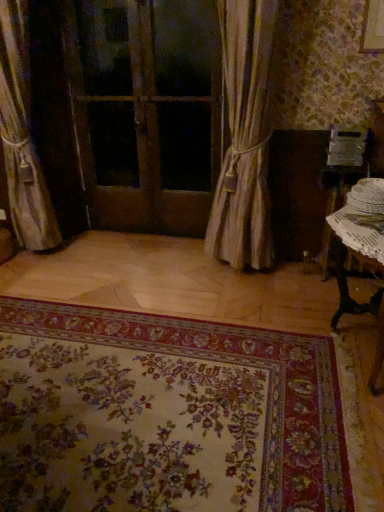
Locate an element on the screen. The image size is (384, 512). free spot behind white wicker table at lower right, which appears as the first table when viewed from the front is located at coordinates (291, 293).